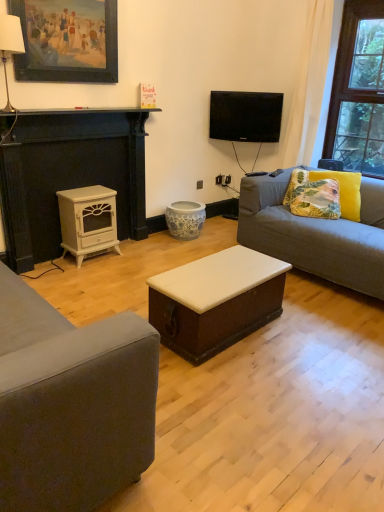
Question: Considering the relative sizes of wooden picture frame at upper left and gray fabric couch at right in the image provided, is wooden picture frame at upper left shorter than gray fabric couch at right?

Choices:
 (A) no
 (B) yes

Answer: (B)

Question: From the image's perspective, is wooden picture frame at upper left above gray fabric couch at right?

Choices:
 (A) no
 (B) yes

Answer: (B)

Question: Does wooden picture frame at upper left come in front of gray fabric couch at right?

Choices:
 (A) no
 (B) yes

Answer: (A)

Question: Is wooden picture frame at upper left oriented towards gray fabric couch at right?

Choices:
 (A) yes
 (B) no

Answer: (B)

Question: Is wooden picture frame at upper left wider than gray fabric couch at right?

Choices:
 (A) yes
 (B) no

Answer: (B)

Question: From the image's perspective, is wooden picture frame at upper left below gray fabric couch at right?

Choices:
 (A) no
 (B) yes

Answer: (A)

Question: Is white fabric lampshade at upper left shorter than wooden picture frame at upper left?

Choices:
 (A) no
 (B) yes

Answer: (B)

Question: Is white fabric lampshade at upper left not near wooden picture frame at upper left?

Choices:
 (A) yes
 (B) no

Answer: (B)

Question: Is white fabric lampshade at upper left positioned with its back to wooden picture frame at upper left?

Choices:
 (A) no
 (B) yes

Answer: (A)

Question: Can you confirm if white fabric lampshade at upper left is taller than wooden picture frame at upper left?

Choices:
 (A) yes
 (B) no

Answer: (B)

Question: Could wooden picture frame at upper left be considered to be inside white fabric lampshade at upper left?

Choices:
 (A) yes
 (B) no

Answer: (B)

Question: From a real-world perspective, does white fabric lampshade at upper left sit lower than wooden picture frame at upper left?

Choices:
 (A) no
 (B) yes

Answer: (B)

Question: From the image's perspective, does white painted wood trunk at center, the second table from the top, appear lower than wooden picture frame at upper left?

Choices:
 (A) no
 (B) yes

Answer: (B)